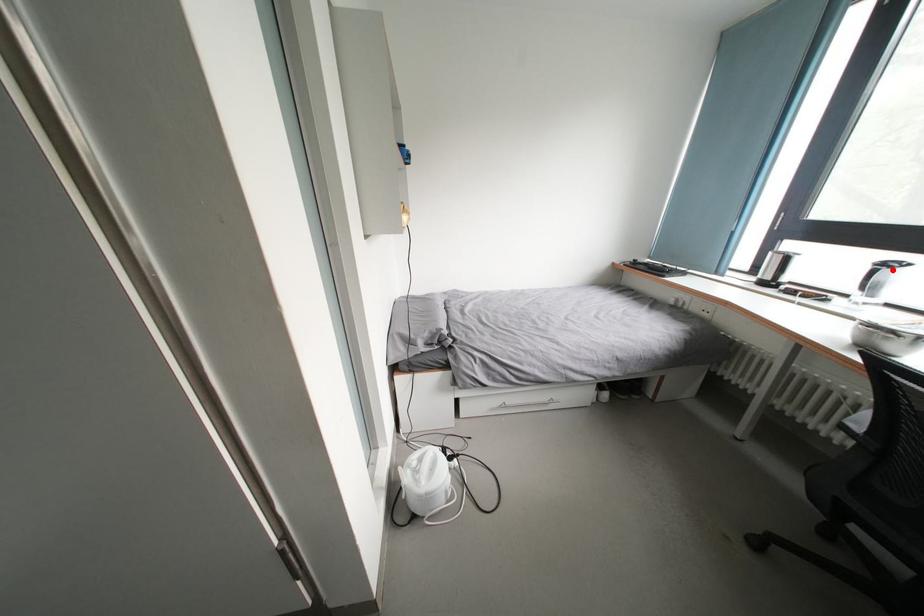
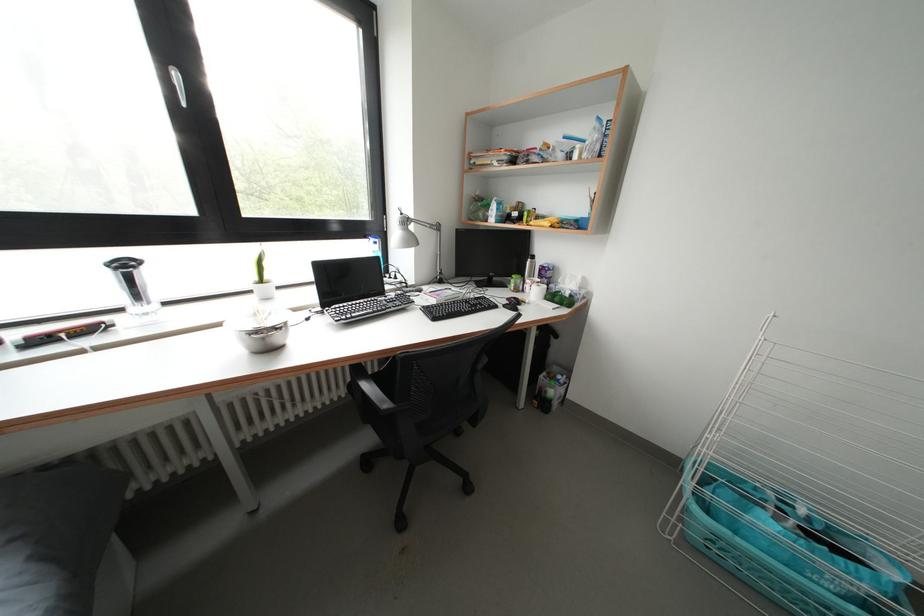
Question: I am providing you with two images of the same scene from different viewpoints. Given a red point in image1, look at the same physical point in image2. Is it:

Choices:
 (A) Closer to the viewpoint
 (B) Farther from the viewpoint

Answer: (A)